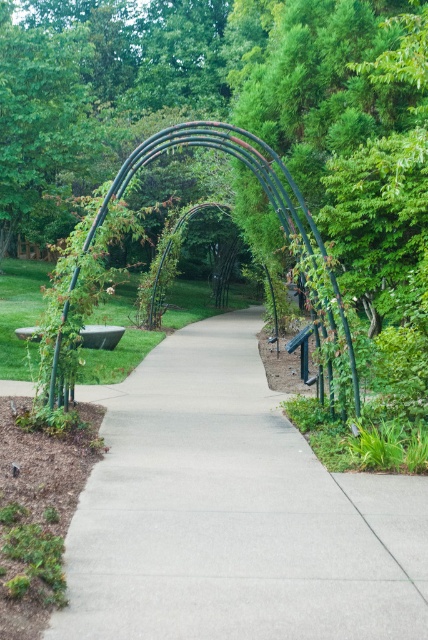
You are standing on the garden pathway and notice two archways ahead. The green metal archway at center and the black metal archway at center. Which one is positioned higher above the pathway?

The green metal archway at center is located above the black metal archway at center, so the green metal archway at center is positioned higher above the pathway.

In the scene shown: You are standing at the entrance of the garden pathway and see the point marked as point (x=253, y=173). What object does this point correspond to?

The point (x=253, y=173) corresponds to the green metal archway at center.